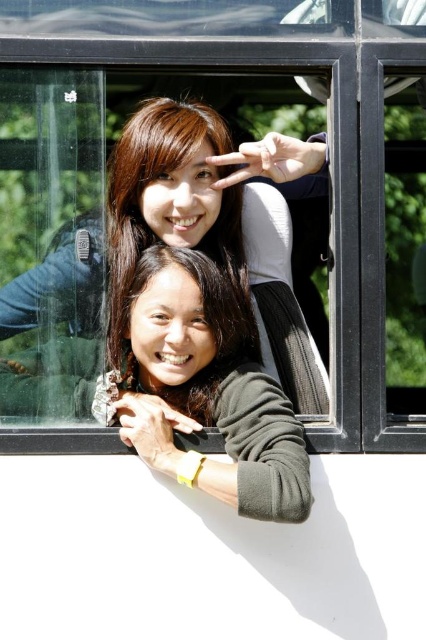
You are a fashion designer observing two people in an image. You notice the matte black sweater at upper center and the dark green sweater at center. Which sweater is closer to the front of the image?

The matte black sweater at upper center is closer to the front of the image because the dark green sweater at center is behind it.

You are a fashion stylist analyzing the clothing in the image. Which of the two sweaters, the matte black sweater at upper center or the dark green sweater at center, would you recommend for a client who prefers a more oversized look?

The matte black sweater at upper center is bigger than the dark green sweater at center, so it would be the better recommendation for an oversized look.

You are a fashion designer observing two sweaters in an image. You see a matte black sweater at upper center and a matte green sweater at center. Which one is positioned lower in the image?

The matte black sweater at upper center is below the matte green sweater at center, so it is positioned lower in the image.